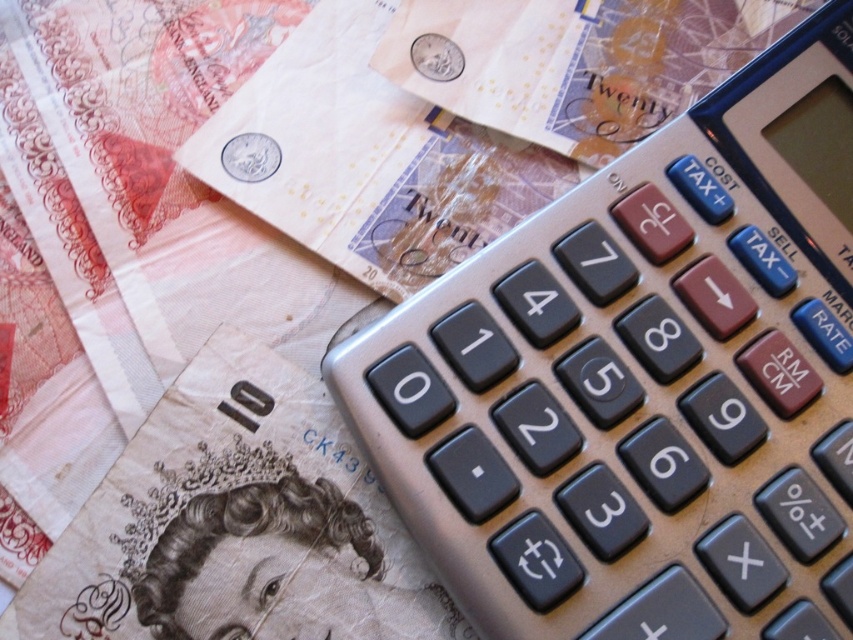
I want to click on silver/black calculator at upper right, so click(643, 381).

Is point (616, 353) less distant than point (61, 588)?

Yes, it is in front of point (61, 588).

Is point (846, 257) in front of point (135, 506)?

No, it is behind (135, 506).

Locate an element on the screen. silver/black calculator at upper right is located at coordinates (643, 381).